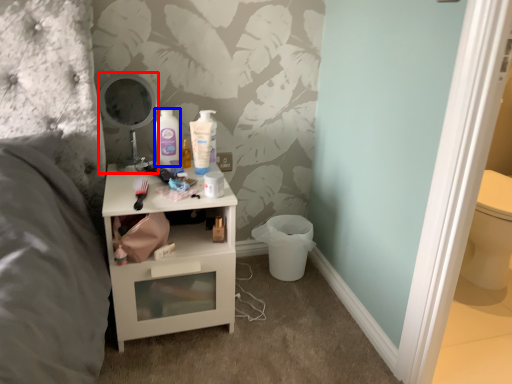
Question: Which point is further to the camera, mirror (highlighted by a red box) or mouthwash (highlighted by a blue box)?

Choices:
 (A) mirror
 (B) mouthwash

Answer: (B)